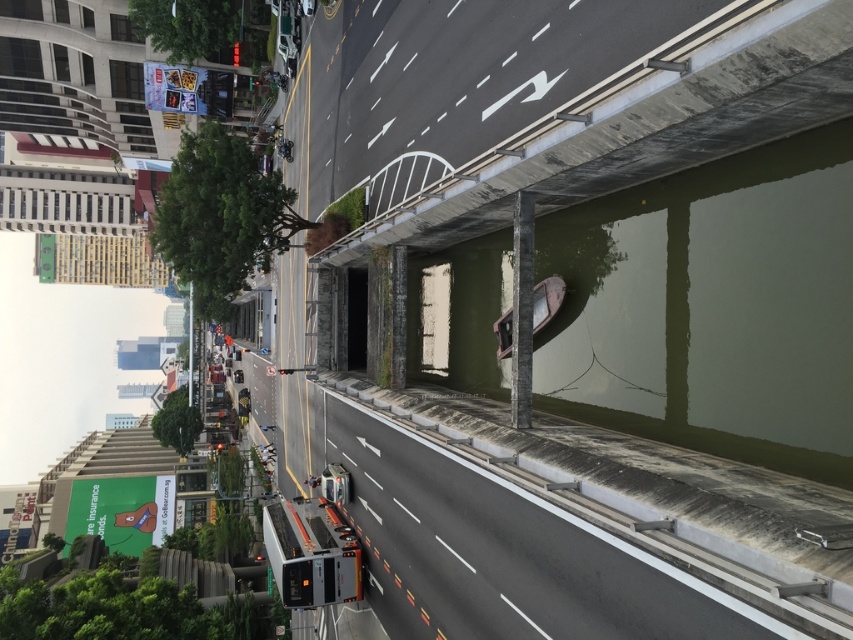
Is concrete at upper center smaller than gray asphalt highway at center?

Correct, concrete at upper center occupies less space than gray asphalt highway at center.

Is concrete at upper center taller than gray asphalt highway at center?

Yes, concrete at upper center is taller than gray asphalt highway at center.

Between point (456, 33) and point (438, 509), which one is positioned in front?

Positioned in front is point (456, 33).

This screenshot has height=640, width=853. I want to click on concrete at upper center, so click(x=549, y=100).